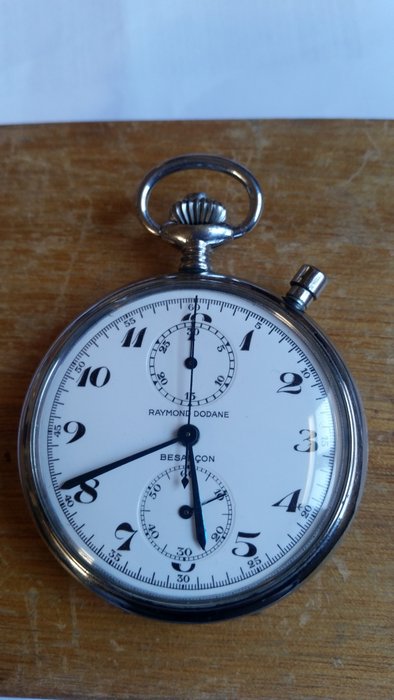
Locate an element on the screen. wood table is located at coordinates (302, 227).